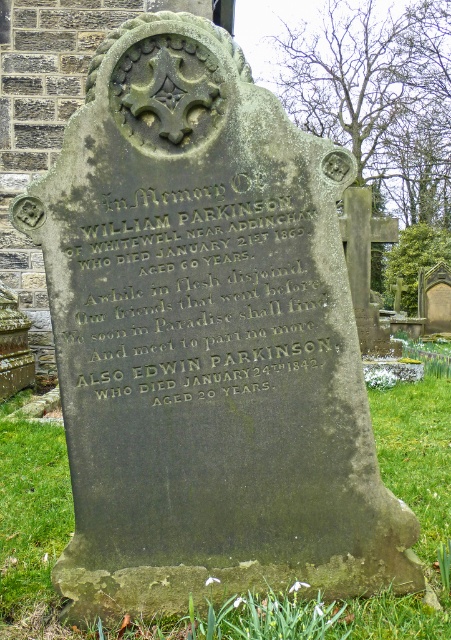
What is the significance of the point marked at coordinates (193, 292) on the gravestone?

The point marked at coordinates (193, 292) on the gravestone indicates the location of the black stone inscription at the center, which contains the commemorative details for William Parkinson and Edwin Parkinson.

You are standing in front of the gravestone and want to place a bouquet of flowers on the green grass at lower center. To reach the grass, do you need to step over the black stone inscription at center?

The black stone inscription at center is closer to the viewer than the green grass at lower center, so you would need to step over it to reach the grass.

You are a historian examining the gravestone and the surrounding area. You need to determine which object, the black stone inscription at center or the green grass at lower center, has a greater width. Based on the scene provided, what can you conclude?

The black stone inscription at center has a greater width than the green grass at lower center.